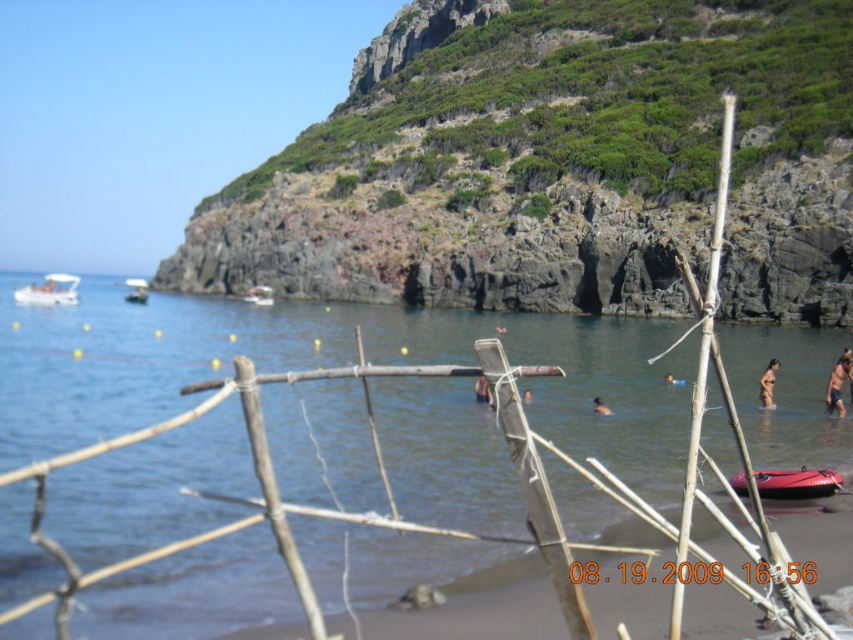
You are a hiker standing at the base of the green rocky hillside at upper center and want to take a photo of the white plastic boat at left. Which object should you position closer to the camera to ensure the boat is clearly visible in the photo?

To ensure the white plastic boat at left is clearly visible in the photo, you should position the green rocky hillside at upper center closer to the camera since it is taller than the white plastic boat at left, allowing both objects to be in frame without one blocking the other.

You are a photographer trying to capture a photo of the tan skin bikini at center and the blue skin at center. Which person should you focus on first if you want to include both in your shot without moving the camera?

You should focus on the tan skin bikini at center first since it is shorter than the blue skin at center, allowing you to frame both in the shot by adjusting the angle slightly.